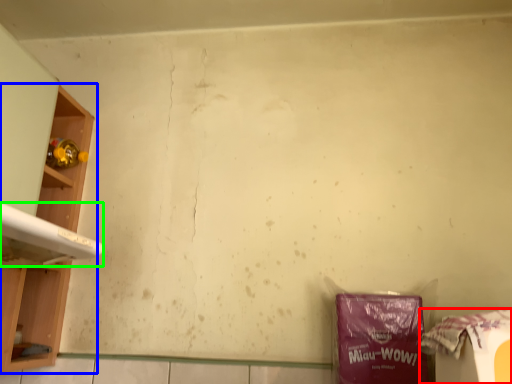
Question: Which is nearer to the waste (highlighted by a red box)? shelf (highlighted by a blue box) or washing (highlighted by a green box).

Choices:
 (A) shelf
 (B) washing

Answer: (B)